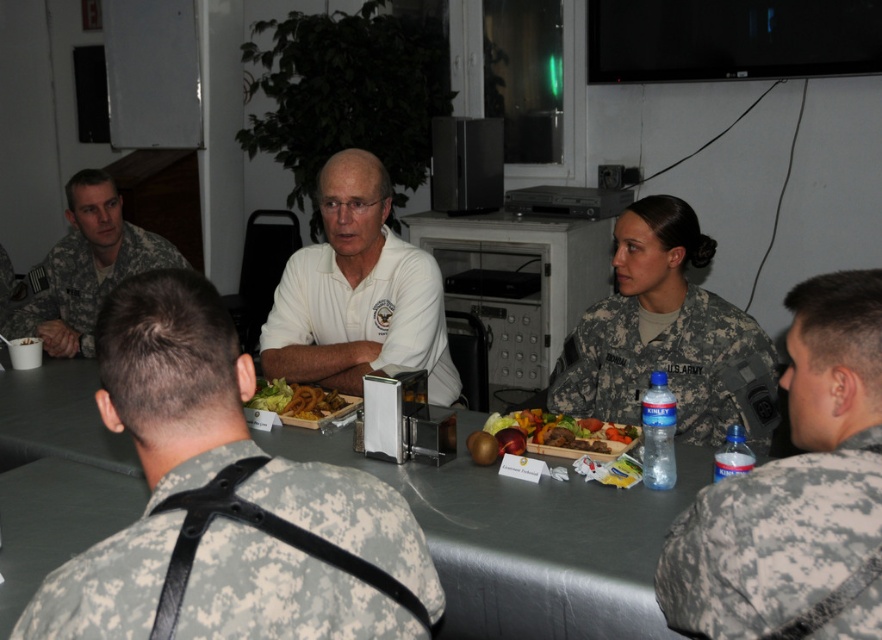
Question: Among these points, which one is farthest from the camera?

Choices:
 (A) (101, 296)
 (B) (736, 484)

Answer: (A)

Question: Does camouflage fabric harness at lower left appear over white matte shirt at center?

Choices:
 (A) no
 (B) yes

Answer: (A)

Question: Which object appears farthest from the camera in this image?

Choices:
 (A) camouflage fabric uniform at lower right
 (B) golden crispy fries at center
 (C) camouflage fabric harness at lower left

Answer: (B)

Question: Does camouflage fabric uniform at center appear on the right side of multicolored wooden tray at center?

Choices:
 (A) yes
 (B) no

Answer: (A)

Question: Which of these objects is positioned farthest from the multicolored wooden tray at center?

Choices:
 (A) camouflage fabric uniform at center
 (B) camouflage fabric uniform at left

Answer: (B)

Question: Can you confirm if camouflage fabric harness at lower left is thinner than camouflage fabric uniform at left?

Choices:
 (A) no
 (B) yes

Answer: (B)